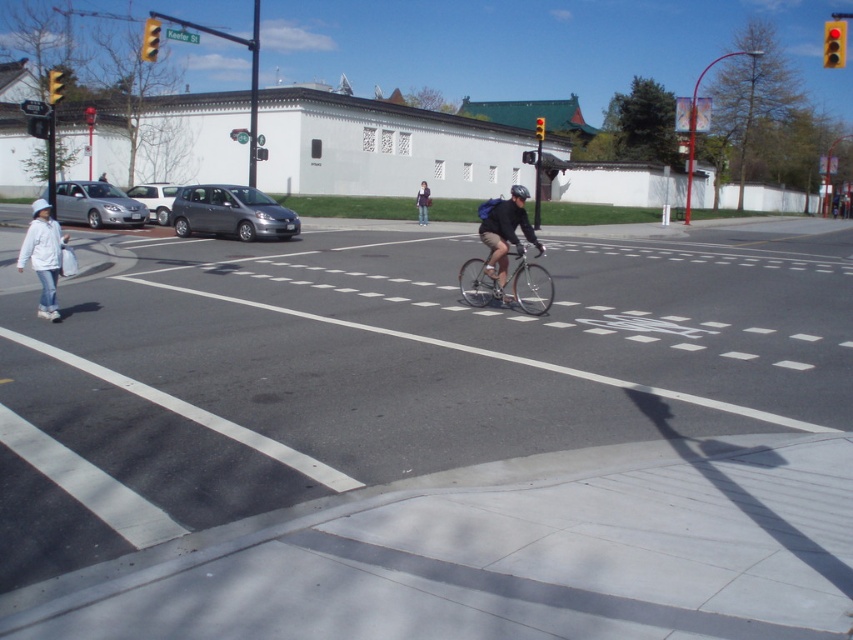
Question: Which of these objects is positioned farthest from the matte black backpack at center?

Choices:
 (A) yellow plastic traffic light at upper left
 (B) silver metallic sedan at left
 (C) yellow plastic traffic light at upper right
 (D) silver metallic bicycle at center

Answer: (A)

Question: Does silver metallic sedan at left appear on the left side of yellow plastic traffic light at upper right?

Choices:
 (A) yes
 (B) no

Answer: (A)

Question: Is yellow plastic traffic light at upper left wider than yellow glass traffic light at upper left?

Choices:
 (A) no
 (B) yes

Answer: (B)

Question: Which is nearer to the yellow glass traffic light at upper left?

Choices:
 (A) yellow plastic traffic light at upper right
 (B) white matte jacket at lower left
 (C) matte black backpack at center

Answer: (C)

Question: Which point is closer to the camera?

Choices:
 (A) (839, 60)
 (B) (424, 189)

Answer: (A)

Question: Can you confirm if silver metallic bicycle at center is positioned below yellow plastic traffic light at upper right?

Choices:
 (A) no
 (B) yes

Answer: (B)